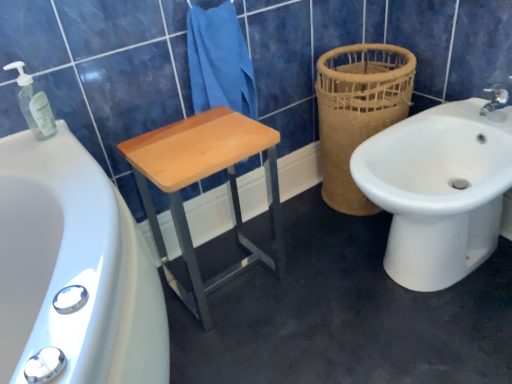
Where is `empty space that is in between light wood/matte stool at center and brown woven basket at right`? empty space that is in between light wood/matte stool at center and brown woven basket at right is located at coordinates (301, 233).